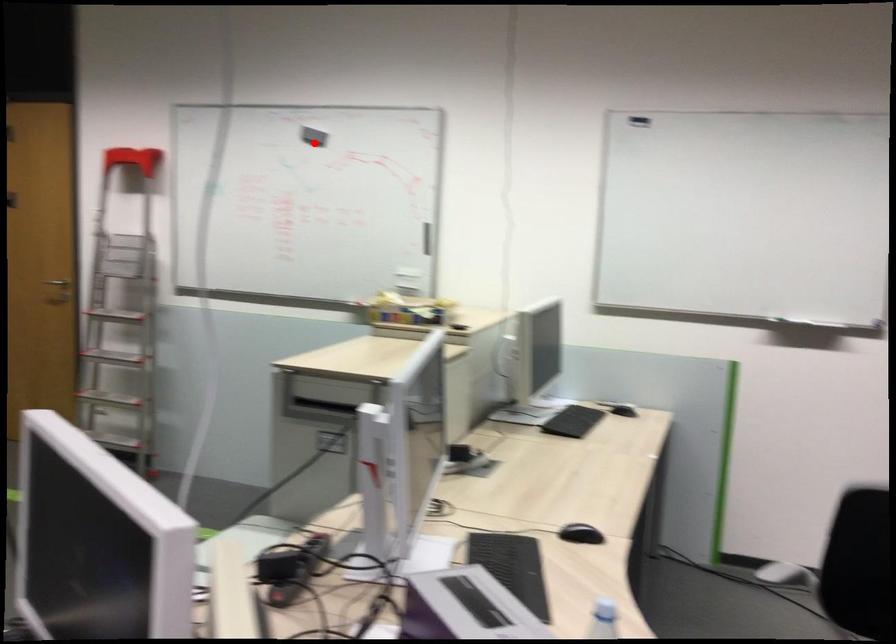
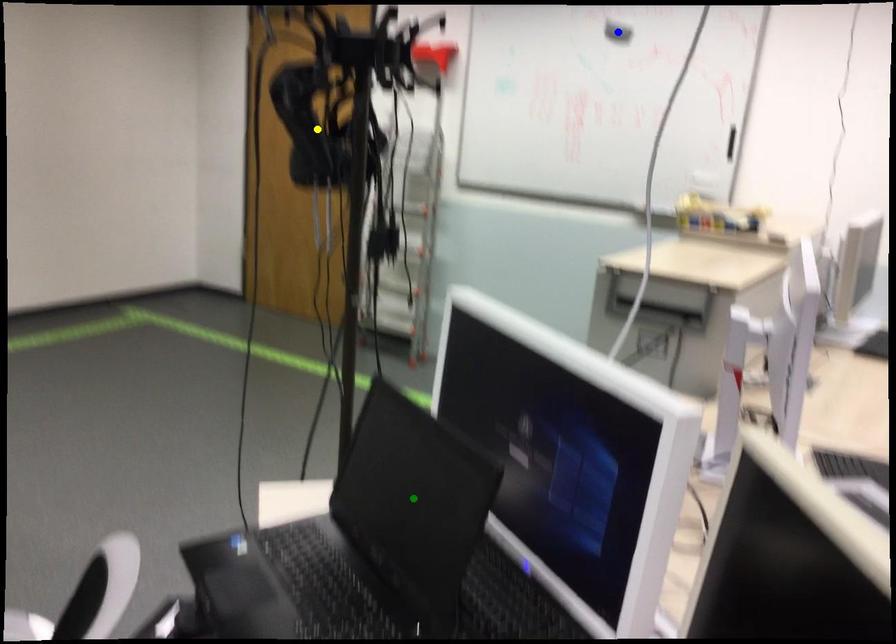
Question: I am providing you with two images of the same scene from different viewpoints. A red point is marked on the first image. You are given multiple points on the second image. In image 2, which mark is for the same physical point as the one in image 1?

Choices:
 (A) yellow point
 (B) green point
 (C) blue point

Answer: (C)